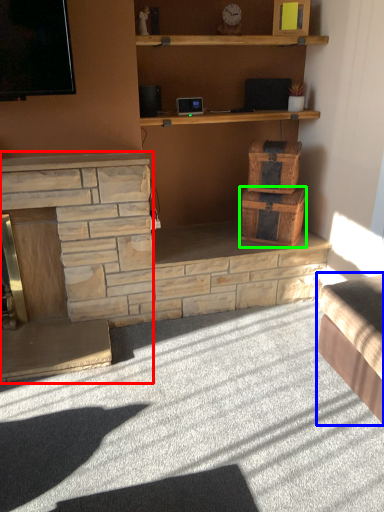
Question: Based on their relative distances, which object is nearer to fireplace (highlighted by a red box)? Choose from studio couch (highlighted by a blue box) and drawer (highlighted by a green box).

Choices:
 (A) studio couch
 (B) drawer

Answer: (B)